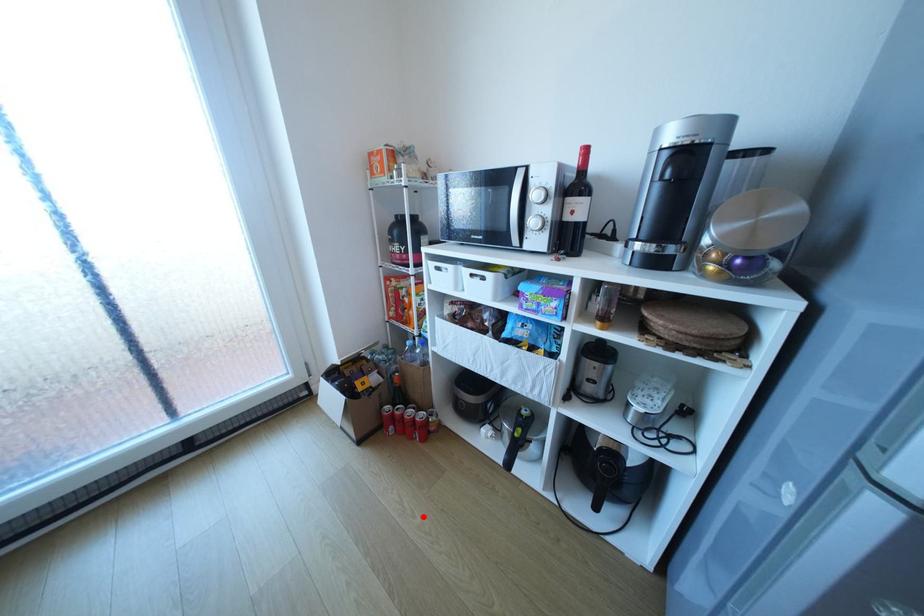
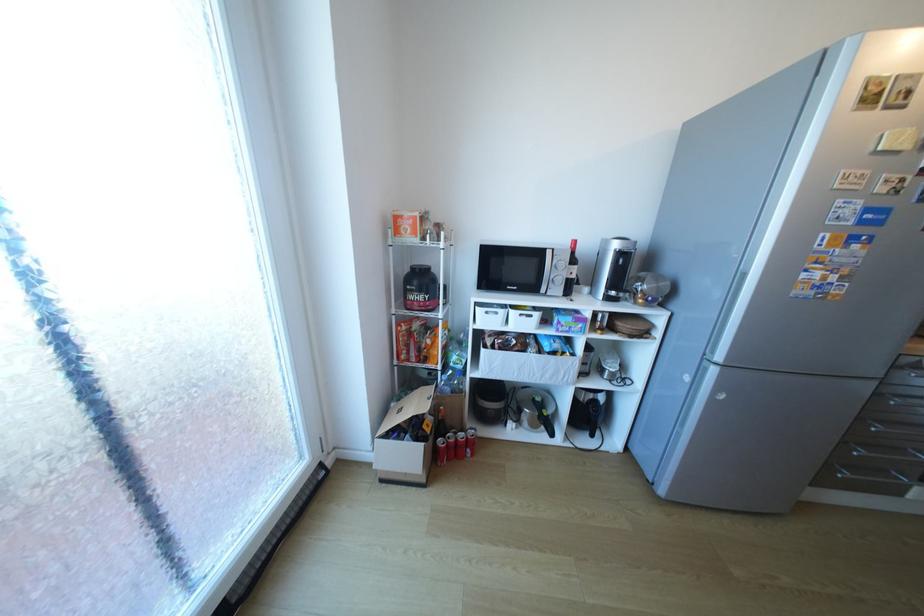
Find the pixel in the second image that matches the highlighted location in the first image.

(523, 504)